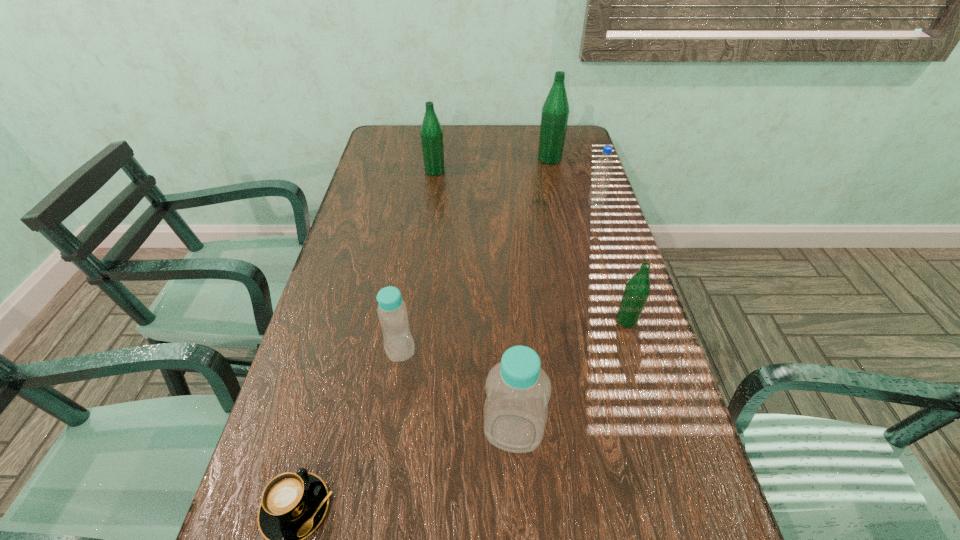
Where is `the second green bottle from left to right`? Image resolution: width=960 pixels, height=540 pixels. the second green bottle from left to right is located at coordinates (555, 112).

Image resolution: width=960 pixels, height=540 pixels. I want to click on the biggest green bottle, so click(x=555, y=112).

The image size is (960, 540). Identify the location of the leftmost green bottle. (431, 132).

You are a GUI agent. You are given a task and a screenshot of the screen. Output one action in this format:
    pyautogui.click(x=<x>, y=<y>)
    Task: Click on the sixth farthest object
    This screenshot has width=960, height=540.
    Given the screenshot: What is the action you would take?
    pyautogui.click(x=518, y=391)

Where is `the third bottle from left to right`? The width and height of the screenshot is (960, 540). the third bottle from left to right is located at coordinates (518, 391).

The image size is (960, 540). Find the location of `water bottle`. water bottle is located at coordinates (597, 195).

What are the coordinates of `the farther blue bottle` in the screenshot? It's located at (399, 346).

Where is `the left blue bottle`? Image resolution: width=960 pixels, height=540 pixels. the left blue bottle is located at coordinates (399, 346).

Find the location of a particular element. Image resolution: width=960 pixels, height=540 pixels. the rightmost bottle is located at coordinates (637, 289).

This screenshot has width=960, height=540. I want to click on the fourth farthest object, so click(637, 289).